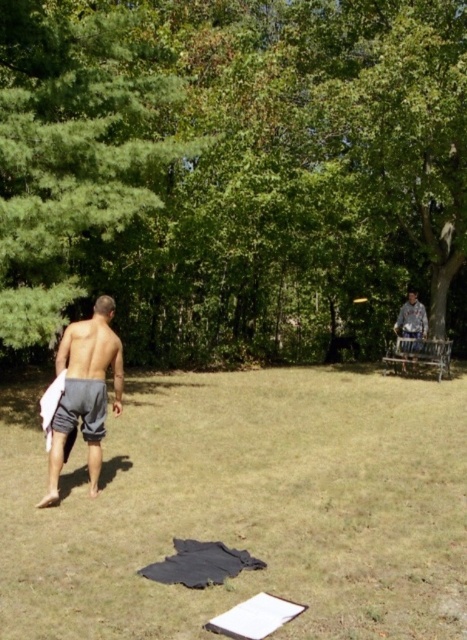
Is point (397, 268) farther from viewer compared to point (356, 499)?

Yes, point (397, 268) is behind point (356, 499).

You are a GUI agent. You are given a task and a screenshot of the screen. Output one action in this format:
    pyautogui.click(x=<x>, y=<y>)
    Task: Click on the green leafy tree at upper center
    
    Given the screenshot: What is the action you would take?
    pyautogui.click(x=232, y=172)

I want to click on green leafy tree at upper center, so click(232, 172).

Between gray cotton shorts at lower left and metallic silver frisbee at center, which one appears on the right side from the viewer's perspective?

metallic silver frisbee at center is more to the right.

Which is below, gray cotton shorts at lower left or metallic silver frisbee at center?

gray cotton shorts at lower left is lower down.

Between point (66, 394) and point (366, 300), which one is positioned behind?

Point (366, 300)

At what (x,y) coordinates should I click in order to perform the action: click on gray cotton shorts at lower left. Please return your answer as a coordinate pair (x, y). The image size is (467, 640). Looking at the image, I should click on (82, 408).

Looking at this image, which is more to the left, green leafy tree at upper center or metallic silver frisbee at center?

green leafy tree at upper center is more to the left.

Which of these two, green leafy tree at upper center or metallic silver frisbee at center, stands shorter?

With less height is metallic silver frisbee at center.

The height and width of the screenshot is (640, 467). I want to click on green leafy tree at upper center, so click(x=232, y=172).